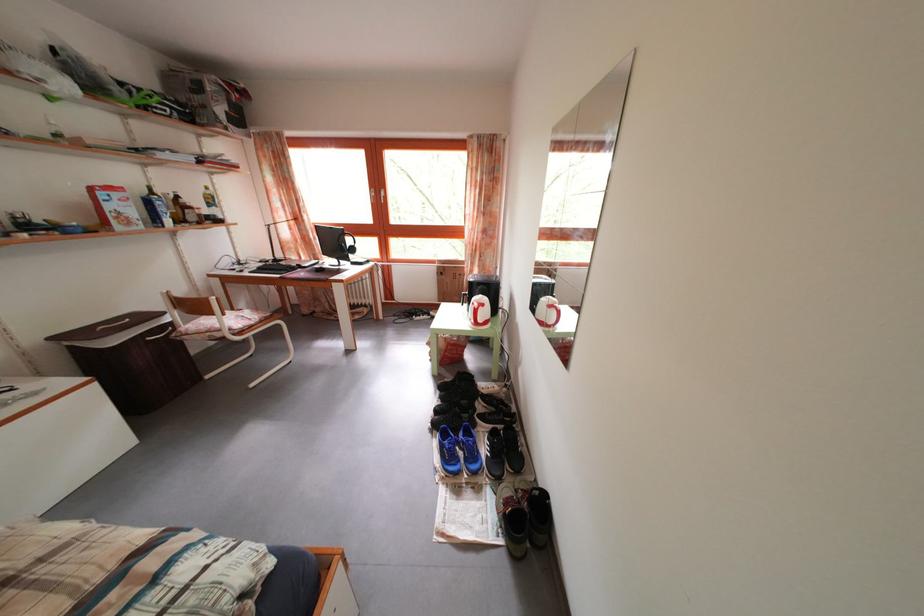
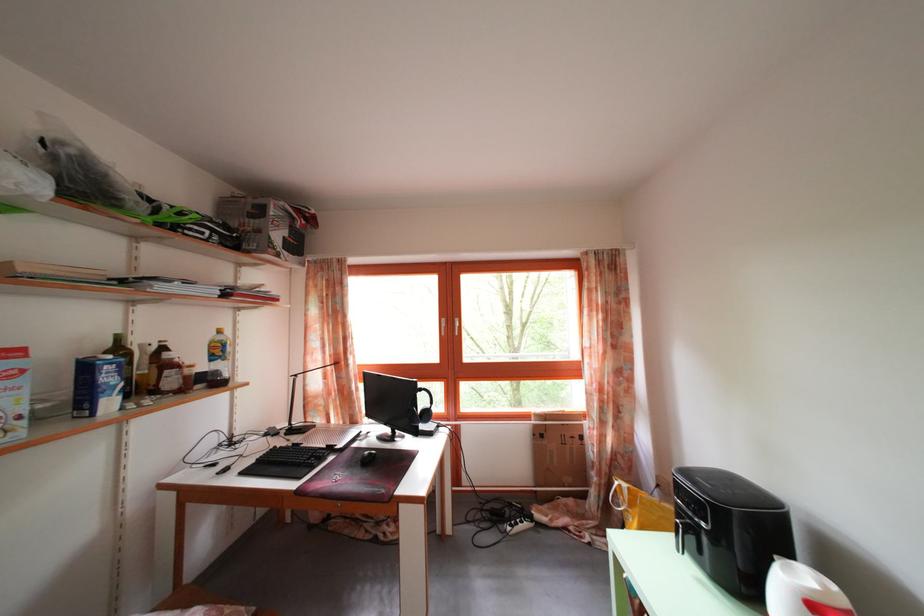
Find the pixel in the second image that matches the point at 217,209 in the first image.

(225, 359)